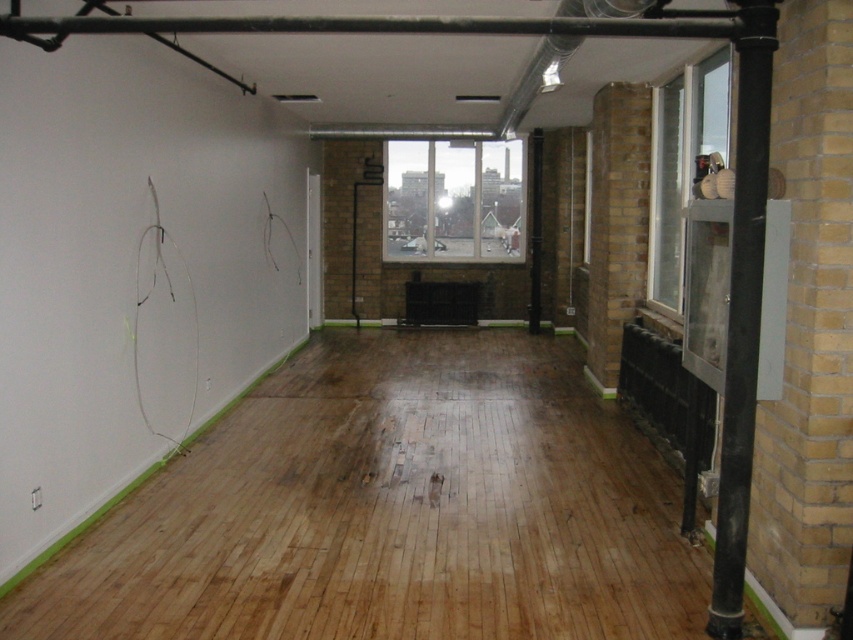
Question: Which point is closer to the camera?

Choices:
 (A) (287, 464)
 (B) (744, 45)

Answer: (B)

Question: Which point appears farthest from the camera in this image?

Choices:
 (A) (740, 536)
 (B) (677, 154)
 (C) (482, 220)

Answer: (C)

Question: Is natural wood flooring at center behind clear glass window at right?

Choices:
 (A) no
 (B) yes

Answer: (A)

Question: Does natural wood flooring at center have a lesser width compared to clear glass window at center?

Choices:
 (A) yes
 (B) no

Answer: (B)

Question: Which object appears closest to the camera in this image?

Choices:
 (A) black metal pole at right
 (B) natural wood flooring at center
 (C) clear glass window at center
 (D) clear glass window at right

Answer: (A)

Question: Does clear glass window at center have a larger size compared to clear glass window at right?

Choices:
 (A) no
 (B) yes

Answer: (B)